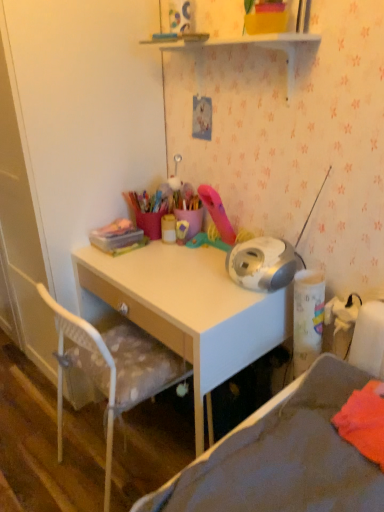
Where is `free location to the right of translucent plastic container at upper left, which appears as the 2th stationery when viewed from the right`? Image resolution: width=384 pixels, height=512 pixels. free location to the right of translucent plastic container at upper left, which appears as the 2th stationery when viewed from the right is located at coordinates (163, 251).